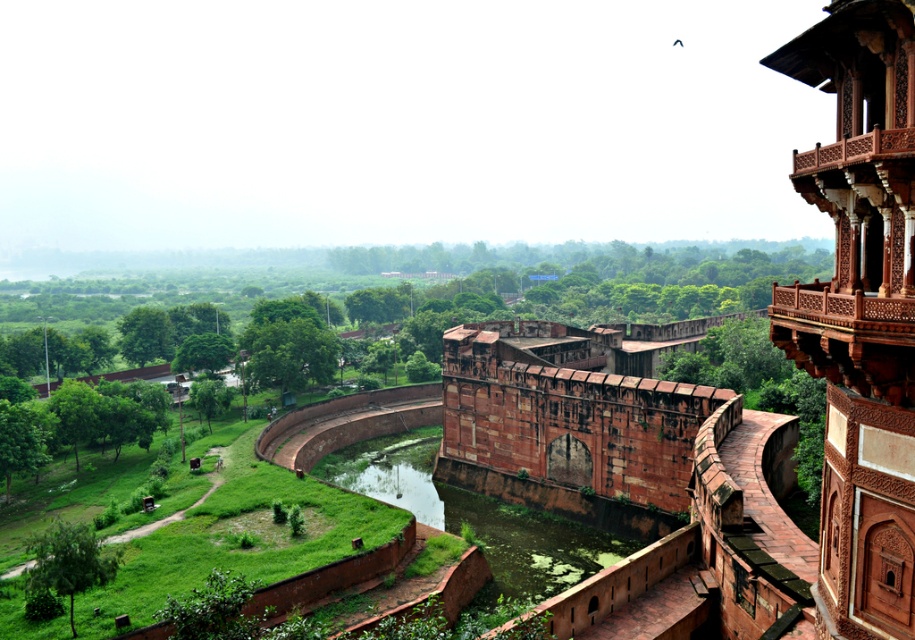
Which is in front, point (905, 561) or point (327, 456)?

Positioned in front is point (905, 561).

Where is `reddish-brown stone fort at right`? reddish-brown stone fort at right is located at coordinates (830, 371).

Who is more forward, (813, 161) or (544, 524)?

Point (813, 161) is more forward.

What are the coordinates of `reddish-brown stone fort at right` in the screenshot? It's located at (830, 371).

Between reddish-brown stone fort at right and rustic stone fortress at center, which one has more height?

reddish-brown stone fort at right is taller.

Between reddish-brown stone fort at right and rustic stone fortress at center, which one appears on the left side from the viewer's perspective?

reddish-brown stone fort at right

Does point (717, 604) lie behind point (479, 385)?

No, (717, 604) is in front of (479, 385).

At what (x,y) coordinates should I click in order to perform the action: click on reddish-brown stone fort at right. Please return your answer as a coordinate pair (x, y). The width and height of the screenshot is (915, 640). Looking at the image, I should click on (830, 371).

Is point (648, 493) behind point (466, 524)?

That is False.

Is point (640, 332) positioned before point (573, 577)?

No, it is not.

Find the location of `rustic stone fortress at center`. rustic stone fortress at center is located at coordinates (574, 406).